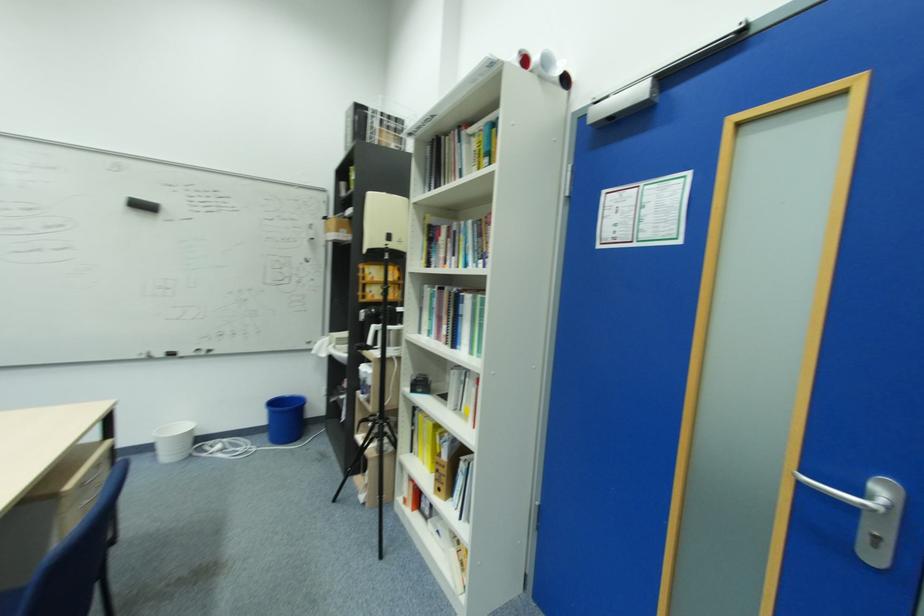
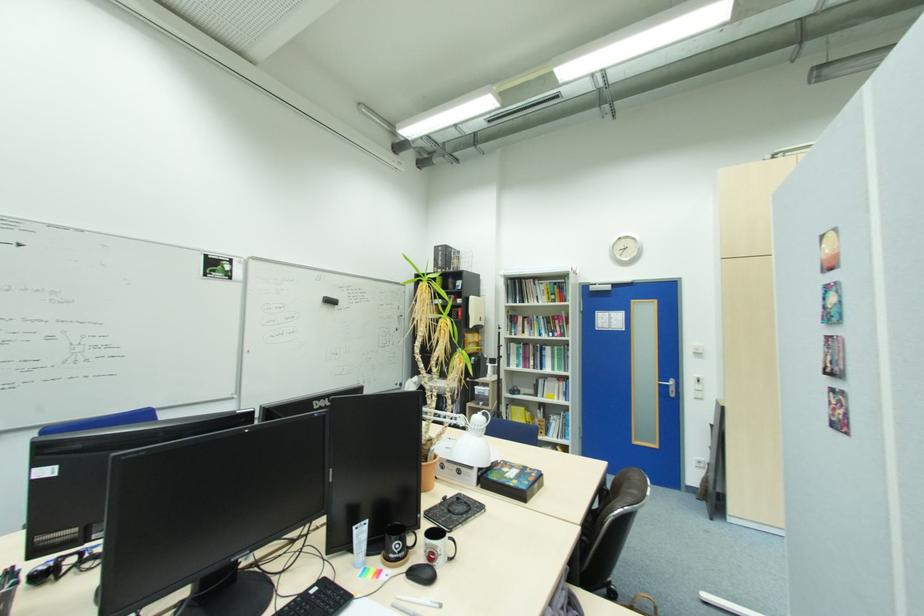
In a continuous first-person perspective shot, in which direction is the camera moving?

→ The movement direction of the cameraman is left, backward.